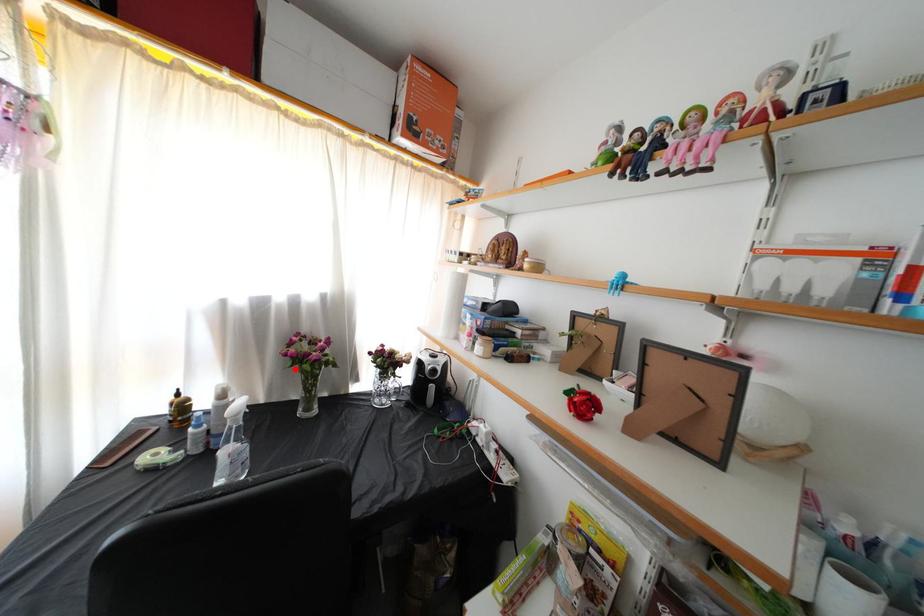
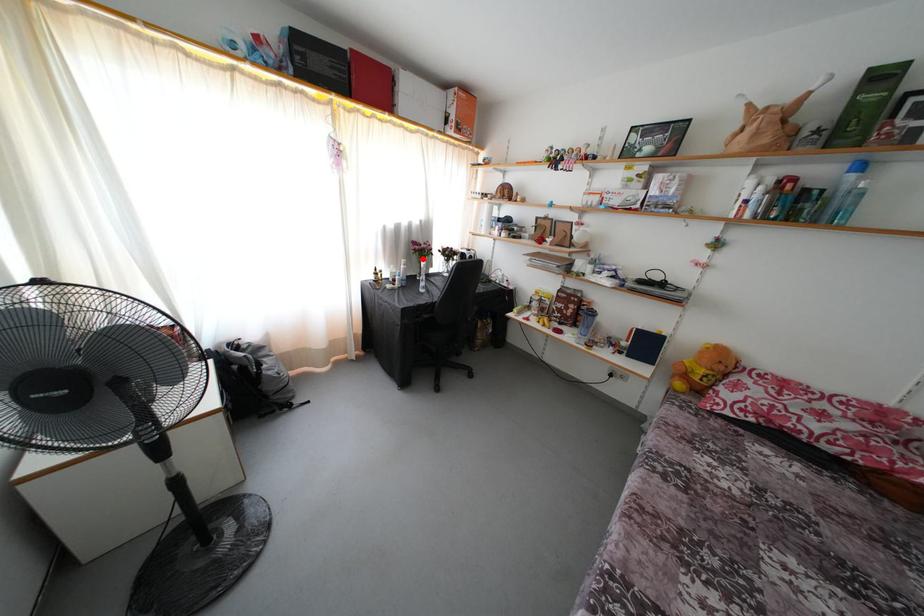
I am providing you with two images of the same scene from different viewpoints. A red point is marked on the first image and another point is marked on the second image. Do the highlighted points in image1 and image2 indicate the same real-world spot?

Yes